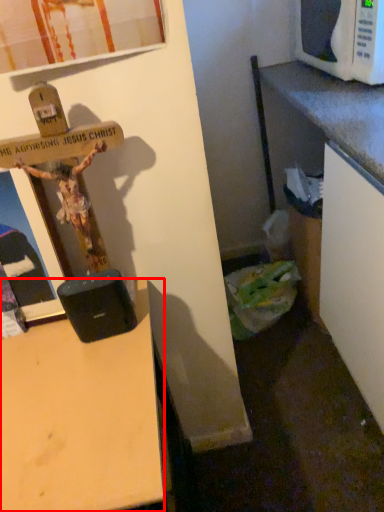
Question: Considering the relative positions of desk (annotated by the red box) and microwave oven in the image provided, where is desk (annotated by the red box) located with respect to the staircase?

Choices:
 (A) left
 (B) right

Answer: (A)